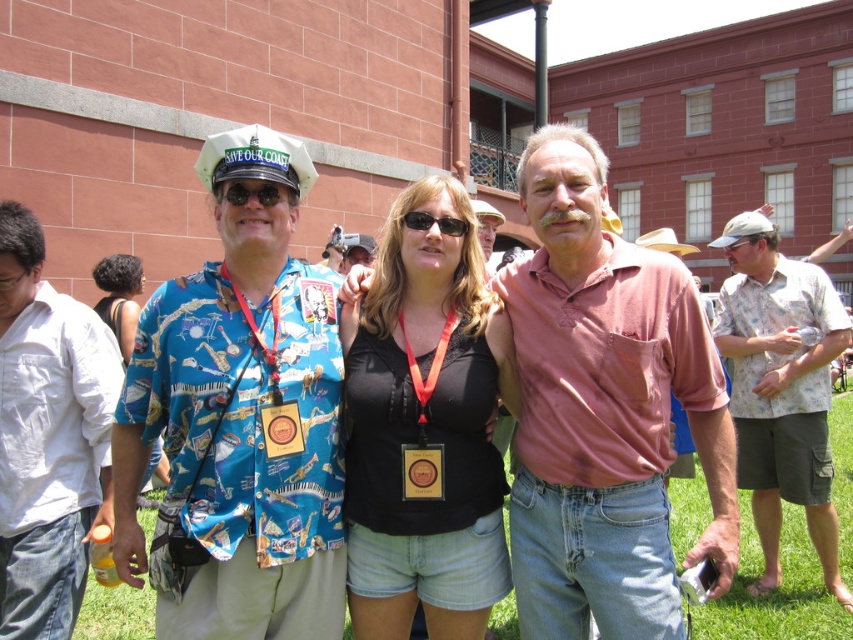
You are standing at the origin point of the coordinate system. Which direction should you move to reach the pink cotton shirt at center?

The pink cotton shirt at center is located at coordinates point (604, 412), so you should move northeast to reach it.

You are a photographer trying to frame a group photo. You have two subjects wearing the blue printed shirt at center and the white cotton shirt at left. Which subject should you position closer to the camera to ensure their shirts appear equally sized in the photo?

To make the shirts appear equally sized in the photo, position the white cotton shirt at left closer to the camera since the blue printed shirt at center is wider and would need to be farther back to match the apparent size of the narrower white cotton shirt at left.